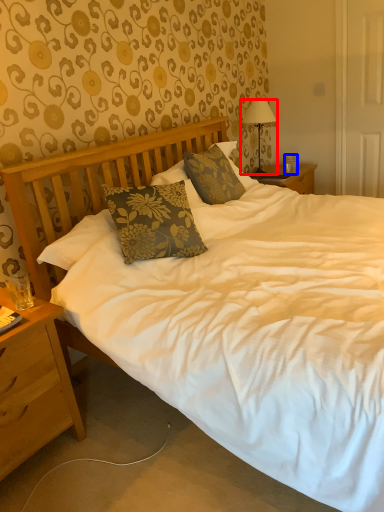
Question: Which object is closer to the camera taking this photo, lamp (highlighted by a red box) or coffee cup (highlighted by a blue box)?

Choices:
 (A) lamp
 (B) coffee cup

Answer: (A)